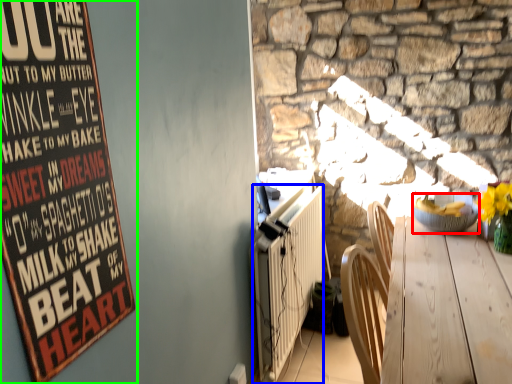
Question: Which object is the closest to the bowl (highlighted by a red box)? Choose among these: radiator (highlighted by a blue box) or poster (highlighted by a green box).

Choices:
 (A) radiator
 (B) poster

Answer: (A)